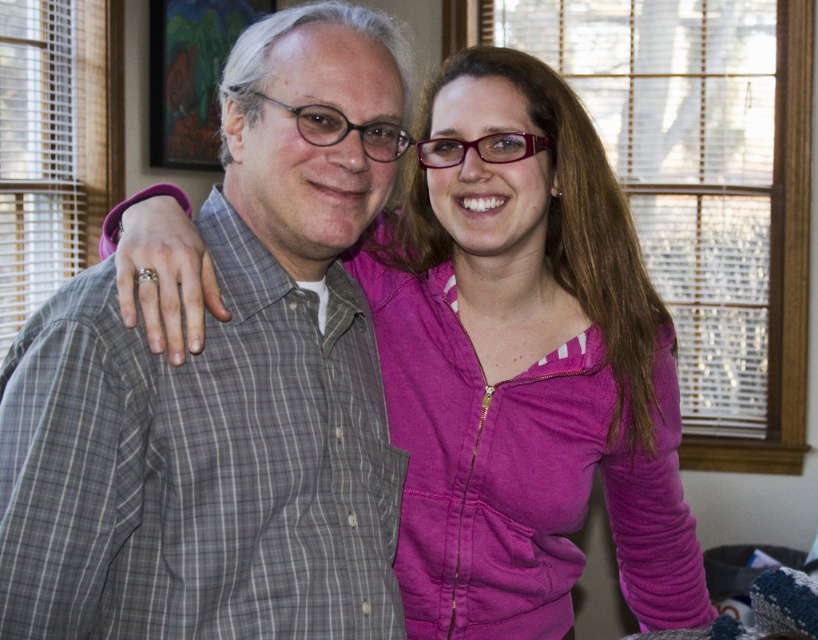
You are trying to locate the gray plaid shirt at center in the image. What are the coordinates where you can find it?

The gray plaid shirt at center can be found at coordinates point (225, 387).